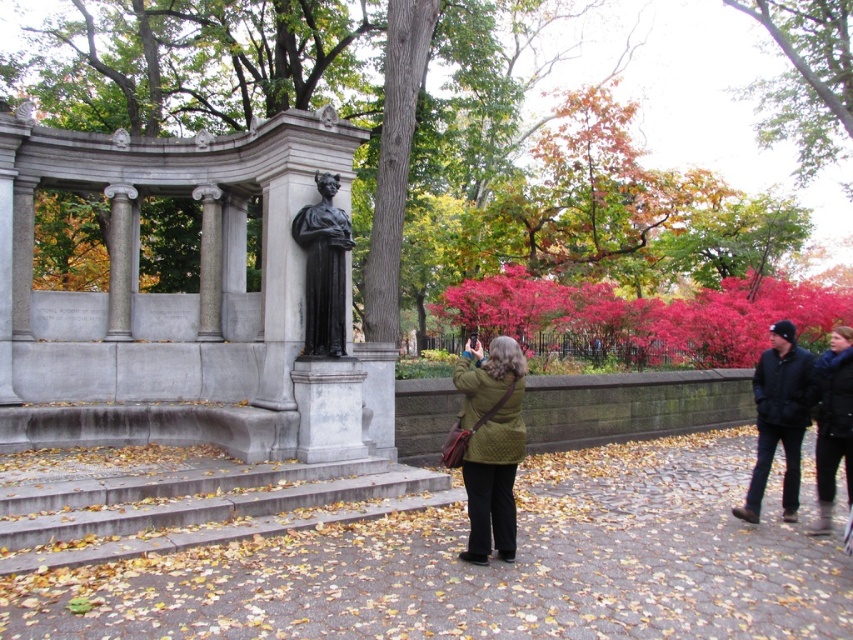
Who is shorter, green textured coat at center or black leather jacket at lower right?

Standing shorter between the two is green textured coat at center.

Between point (505, 532) and point (845, 342), which one is positioned in front?

Point (505, 532) is in front.

Which is in front, point (445, 465) or point (845, 360)?

Point (445, 465)

Locate an element on the screen. green textured coat at center is located at coordinates (488, 444).

How far apart are gray concrete stairs at lower center and black leather jacket at right?

A distance of 4.70 meters exists between gray concrete stairs at lower center and black leather jacket at right.

Who is lower down, gray concrete stairs at lower center or black leather jacket at right?

gray concrete stairs at lower center is below.

Between point (252, 522) and point (798, 419), which one is positioned behind?

Positioned behind is point (798, 419).

I want to click on gray concrete stairs at lower center, so click(196, 506).

Between gray concrete stairs at lower center and green textured coat at center, which one appears on the right side from the viewer's perspective?

Positioned to the right is green textured coat at center.

Which is above, gray concrete stairs at lower center or green textured coat at center?

green textured coat at center

Does point (148, 481) lie in front of point (486, 448)?

No, (148, 481) is further to viewer.

You are a GUI agent. You are given a task and a screenshot of the screen. Output one action in this format:
    pyautogui.click(x=<x>, y=<y>)
    Task: Click on the gray concrete stairs at lower center
    The height and width of the screenshot is (640, 853).
    Given the screenshot: What is the action you would take?
    196,506